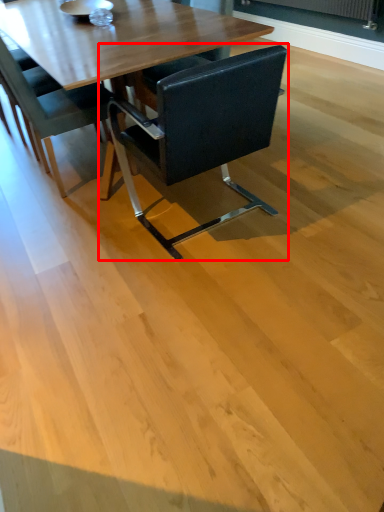
Question: From the image's perspective, considering the relative positions of chair (annotated by the red box) and chair in the image provided, where is chair (annotated by the red box) located with respect to the staircase?

Choices:
 (A) above
 (B) below

Answer: (B)